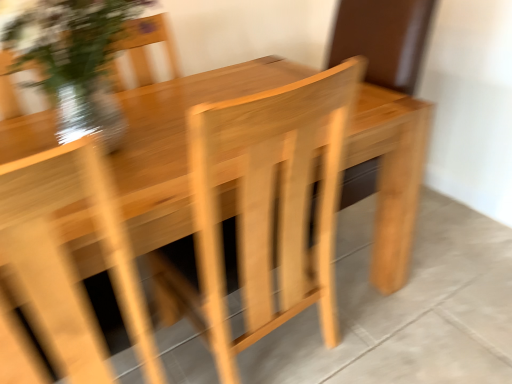
In order to click on free point above natural wood table at center (from a real-world perspective) in this screenshot , I will do `click(167, 116)`.